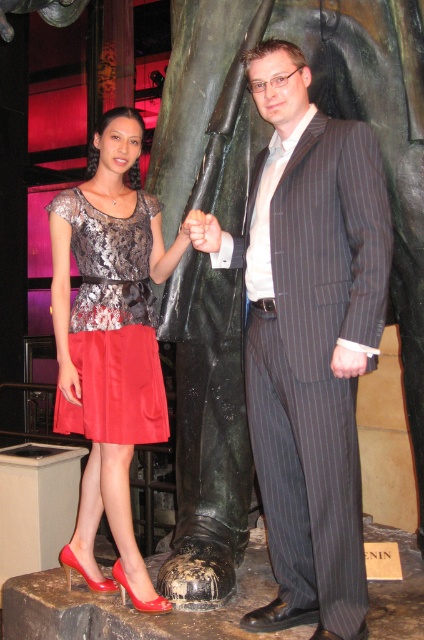
Is satin red dress at center above smooth skin hand at center?

Actually, satin red dress at center is below smooth skin hand at center.

Who is more forward, (x=141, y=356) or (x=206, y=227)?

Point (x=206, y=227) is more forward.

Is point (109, 259) positioned before point (192, 237)?

No, (109, 259) is further to viewer.

At what (x,y) coordinates should I click in order to perform the action: click on satin red dress at center. Please return your answer as a coordinate pair (x, y). Looking at the image, I should click on (113, 326).

Who is higher up, satin dress at left or satin red dress at center?

Positioned higher is satin red dress at center.

Where is `satin dress at left`? The height and width of the screenshot is (640, 424). satin dress at left is located at coordinates (109, 342).

Is the position of striped pinstripe suit at center less distant than that of satin red dress at center?

Yes.

Is striped pinstripe suit at center to the left of satin red dress at center from the viewer's perspective?

In fact, striped pinstripe suit at center is to the right of satin red dress at center.

Find the location of `striped pinstripe suit at center`. striped pinstripe suit at center is located at coordinates (309, 340).

Locate an element on the screen. striped pinstripe suit at center is located at coordinates (309, 340).